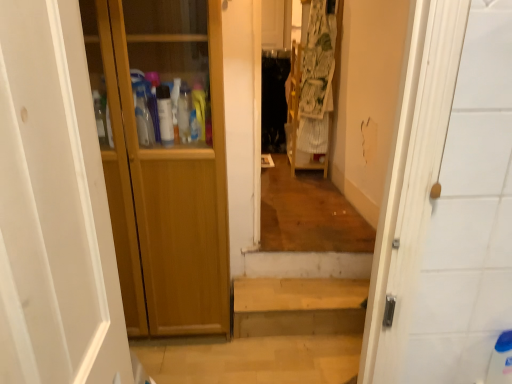
The width and height of the screenshot is (512, 384). Identify the location of vacant area that is in front of wooden stairs at center. (302, 355).